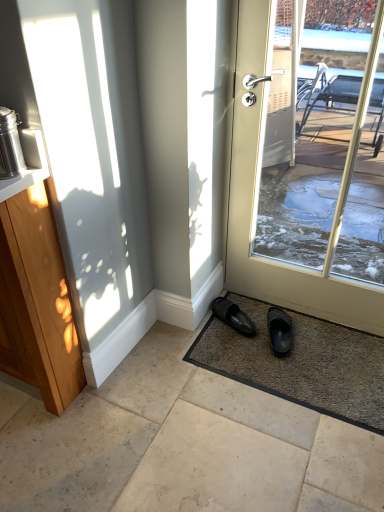
Where is `free space to the left of brown textured mat at lower center`? free space to the left of brown textured mat at lower center is located at coordinates (161, 401).